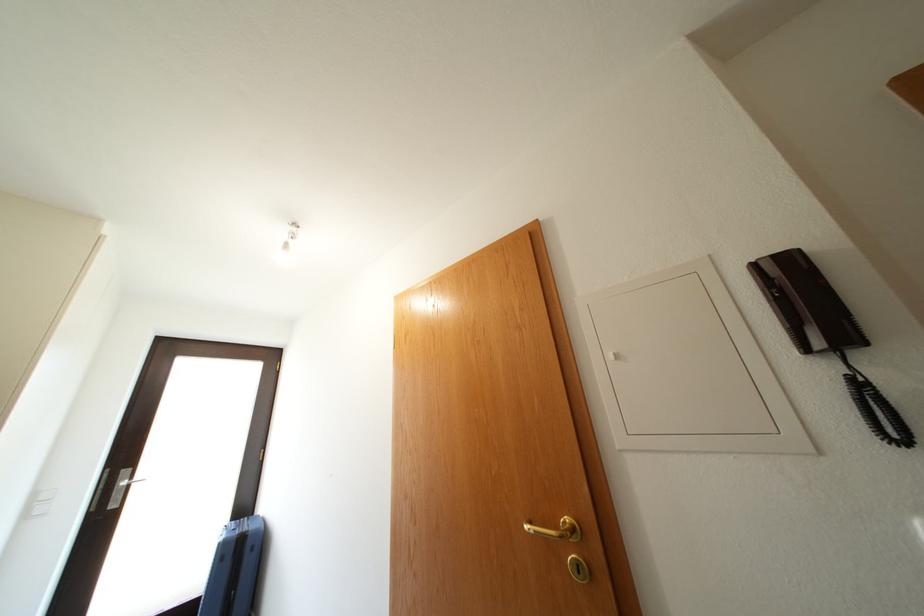
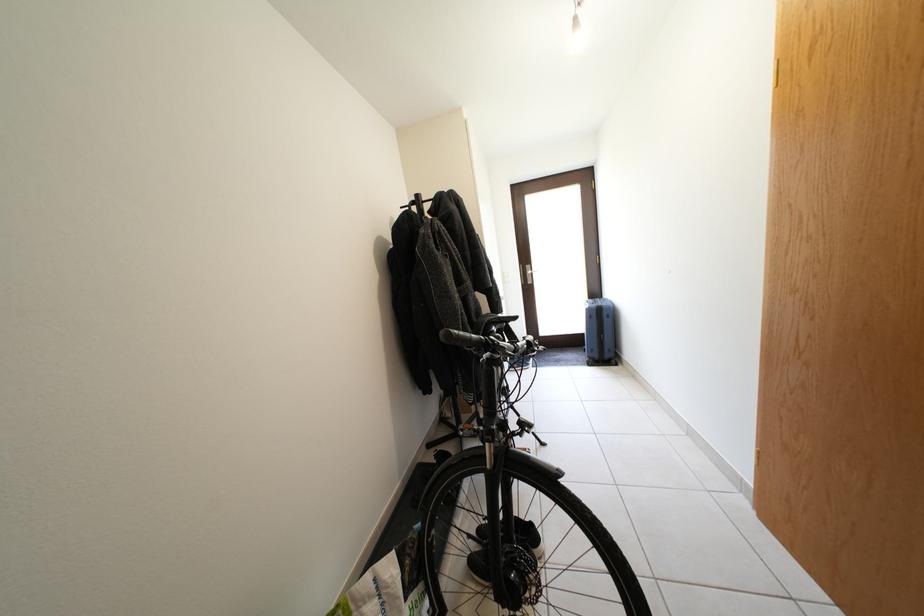
The first image is from the beginning of the video and the second image is from the end. How did the camera likely rotate when shooting the video?

The camera's rotation is toward left-down.